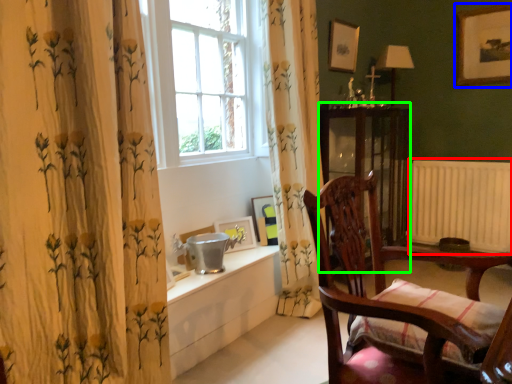
Question: Considering the real-world distances, which object is closest to radiator (highlighted by a red box)? picture frame (highlighted by a blue box) or screen door (highlighted by a green box).

Choices:
 (A) picture frame
 (B) screen door

Answer: (B)